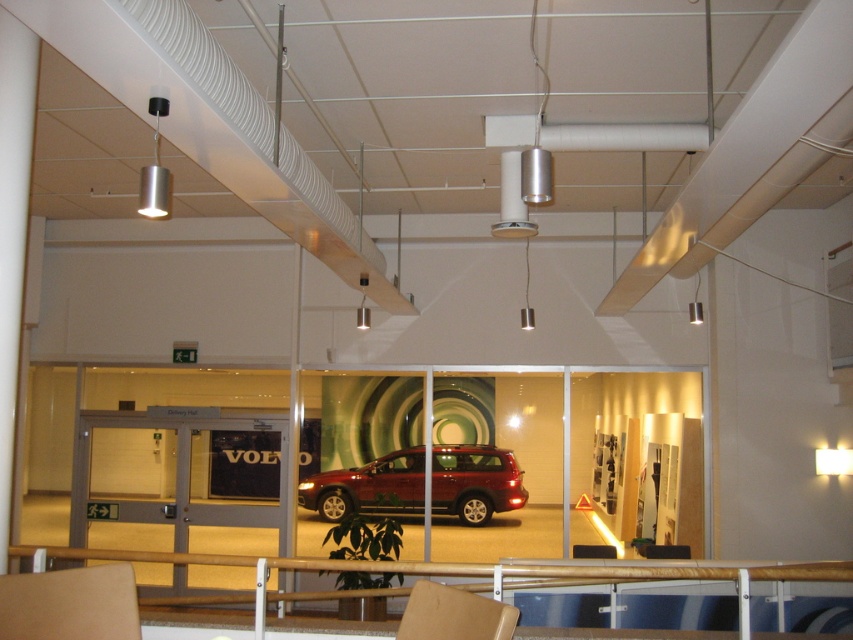
You are a delivery person with a cart that is 2 meters wide. You need to move from the shiny metallic car at center to the matte brown chair at lower left. Is there enough space between them for your cart to pass through?

The distance between the shiny metallic car at center and the matte brown chair at lower left is 10.07 meters, so yes, the cart can pass through since the space is wider than the cart.

You are standing at the entrance of the showroom and want to sit down. There are two options available, the matte brown chair at lower left and the matte brown chair at center. Which chair is closer to you?

The matte brown chair at lower left is closer to you because the matte brown chair at center is behind it.

Based on the photo, you are standing at the entrance of the showroom and see the point marked at coordinates (x=368, y=486). What object is located at that point?

The point at coordinates (x=368, y=486) marks the location of the shiny metallic car at center.